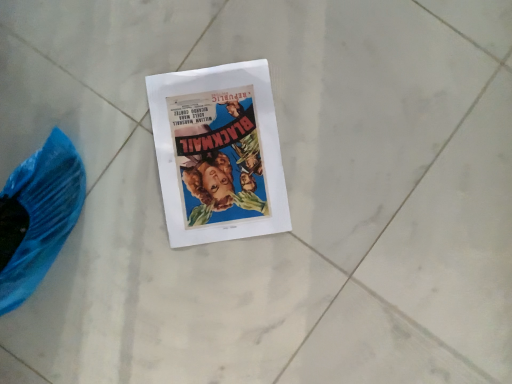
The width and height of the screenshot is (512, 384). Find the location of `matte paper poster at center`. matte paper poster at center is located at coordinates (218, 153).

Image resolution: width=512 pixels, height=384 pixels. What do you see at coordinates (218, 153) in the screenshot? I see `matte paper poster at center` at bounding box center [218, 153].

Find the location of a particular element. The height and width of the screenshot is (384, 512). matte paper poster at center is located at coordinates (218, 153).